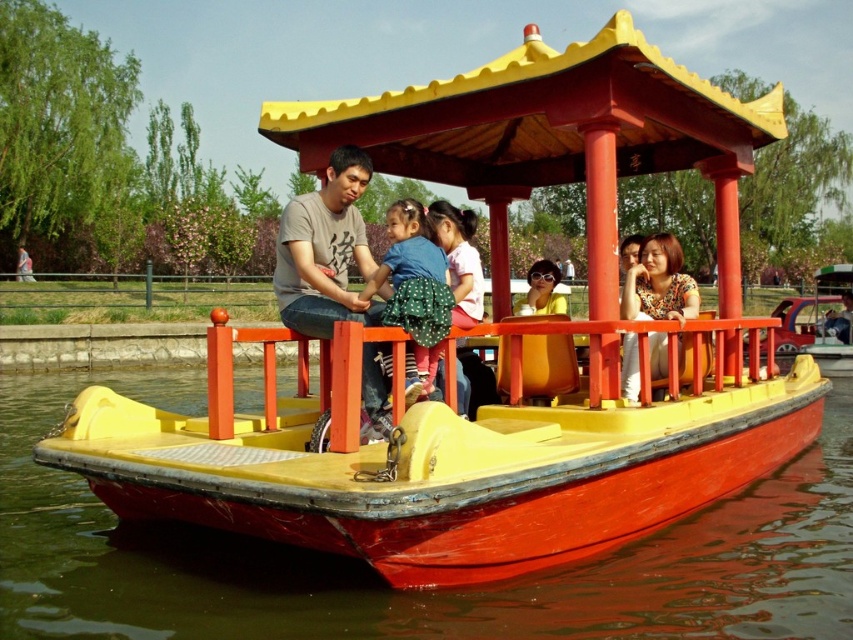
You are standing on the dock and looking at the boat. There are two points marked on the boat. One is at coordinates point (787,545) and the other is at point (660,291). Which point is closer to you?

Point (787,545) is closer to the viewer than point (660,291).

You are standing on the dock and looking at the boat. There are two points marked on the boat. Which point is closer to you, point [322,228] or point [434,337]?

Point [322,228] is closer to you because it is further to the viewer than point [434,337].